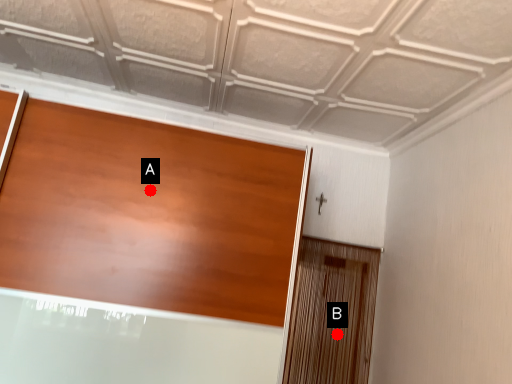
Question: Two points are circled on the image, labeled by A and B beside each circle. Which point appears farthest from the camera in this image?

Choices:
 (A) A is further
 (B) B is further

Answer: (B)